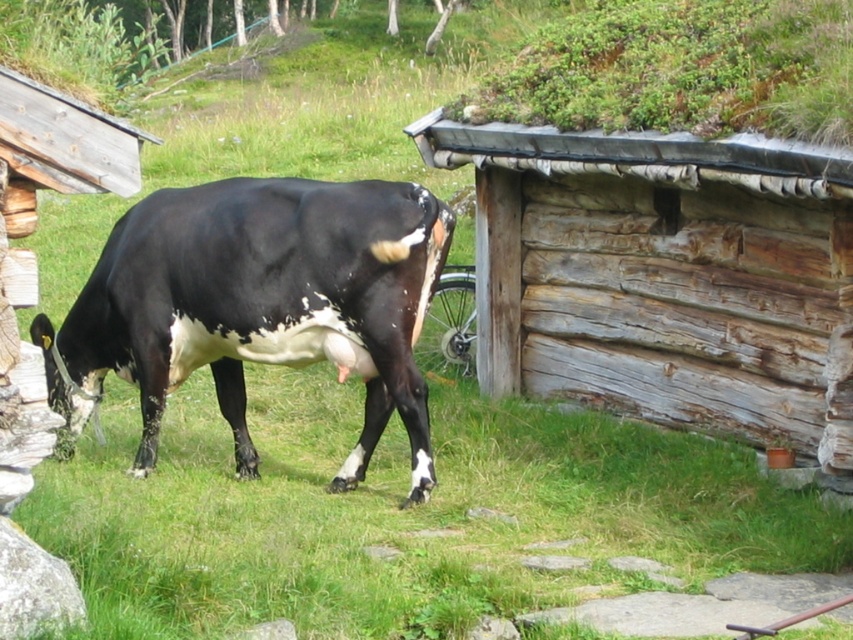
Question: Is weathered wood log cabin at center-right positioned before black glossy cow at center?

Choices:
 (A) no
 (B) yes

Answer: (B)

Question: Does weathered wood log cabin at center-right have a smaller size compared to black glossy cow at center?

Choices:
 (A) no
 (B) yes

Answer: (A)

Question: Which point is farther to the camera?

Choices:
 (A) black glossy cow at center
 (B) weathered wood log cabin at center-right

Answer: (A)

Question: Which point is farther from the camera taking this photo?

Choices:
 (A) (799, 444)
 (B) (161, 355)

Answer: (B)

Question: Is weathered wood log cabin at center-right wider than black glossy cow at center?

Choices:
 (A) no
 (B) yes

Answer: (A)